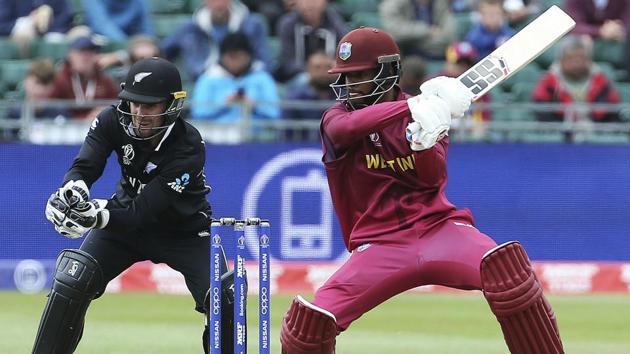
Identify the location of video screen. click(x=561, y=209), click(x=230, y=180), click(x=30, y=167).